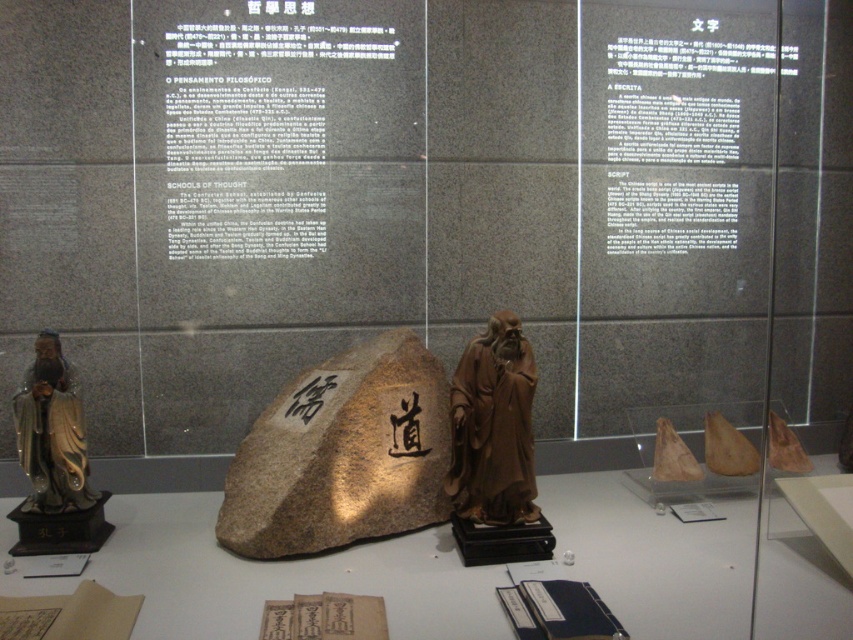
Can you confirm if brown polished rock at center is bigger than brown wooden statue at center?

Indeed, brown polished rock at center has a larger size compared to brown wooden statue at center.

Who is more forward, [234,452] or [527,497]?

Point [527,497]

Find the location of a particular element. The width and height of the screenshot is (853, 640). brown polished rock at center is located at coordinates (341, 454).

Is brown wooden statue at center to the left of gold lacquered statue at left from the viewer's perspective?

No, brown wooden statue at center is not to the left of gold lacquered statue at left.

Can you confirm if brown wooden statue at center is bigger than gold lacquered statue at left?

Yes, brown wooden statue at center is bigger than gold lacquered statue at left.

The height and width of the screenshot is (640, 853). Identify the location of brown wooden statue at center. (492, 426).

Does brown polished rock at center appear over gold lacquered statue at left?

Incorrect, brown polished rock at center is not positioned above gold lacquered statue at left.

Between brown polished rock at center and gold lacquered statue at left, which one is positioned lower?

brown polished rock at center

Is point (447, 448) positioned after point (22, 387)?

Yes, point (447, 448) is behind point (22, 387).

Identify the location of brown polished rock at center. (341, 454).